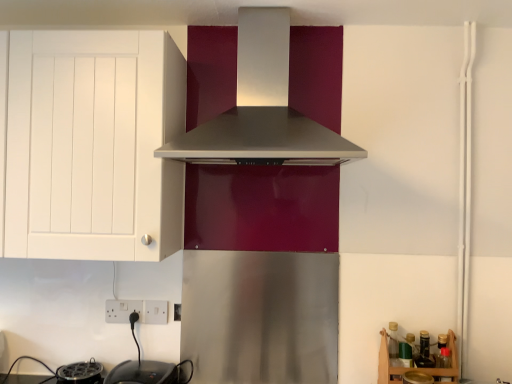
Question: Considering the positions of point (321, 144) and point (386, 344), is point (321, 144) closer or farther from the camera than point (386, 344)?

Choices:
 (A) farther
 (B) closer

Answer: (B)

Question: Is satin silver range hood at center inside or outside of wooden at lower right?

Choices:
 (A) outside
 (B) inside

Answer: (A)

Question: Which object is the closest to the wooden at lower right?

Choices:
 (A) satin silver range hood at center
 (B) white matte cabinet at left
 (C) black plastic toaster at lower left, positioned as the second appliance in right-to-left order
 (D) black glossy electric kettle at lower left, which is counted as the 1th appliance, starting from the right

Answer: (D)

Question: Which of these objects is positioned farthest from the black glossy electric kettle at lower left, which is counted as the 1th appliance, starting from the right?

Choices:
 (A) white matte cabinet at left
 (B) black plastic toaster at lower left, positioned as the second appliance in right-to-left order
 (C) wooden at lower right
 (D) satin silver range hood at center

Answer: (D)